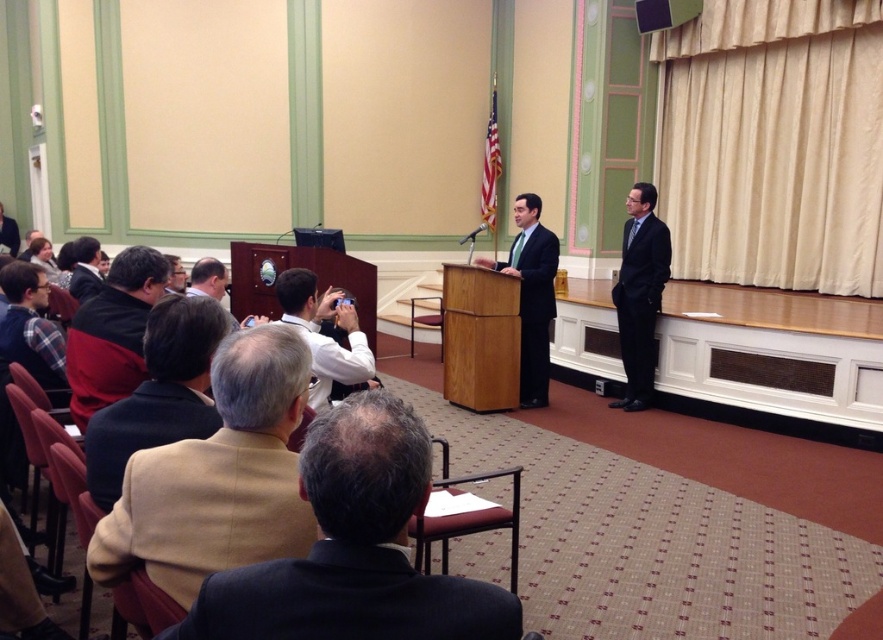
Question: Considering the real-world distances, which object is closest to the dark suit at center?

Choices:
 (A) plaid fabric shirt at left
 (B) dark brown leather jacket at lower left
 (C) tan wool coat at lower left

Answer: (A)

Question: Considering the relative positions of dark brown suit at lower center and dark brown leather jacket at lower left in the image provided, where is dark brown suit at lower center located with respect to dark brown leather jacket at lower left?

Choices:
 (A) above
 (B) below

Answer: (B)

Question: Which of the following is the farthest from the observer?

Choices:
 (A) (429, 324)
 (B) (114, 444)
 (C) (529, 284)

Answer: (A)

Question: Is tan wool coat at lower left wider than wooden chair at center?

Choices:
 (A) no
 (B) yes

Answer: (B)

Question: Which of the following is the farthest from the observer?

Choices:
 (A) light brown leather jacket at lower left
 (B) dark brown leather jacket at lower left
 (C) plaid fabric shirt at left

Answer: (A)

Question: Where is red knit sweater at left located in relation to light brown leather jacket at lower left in the image?

Choices:
 (A) right
 (B) left

Answer: (A)